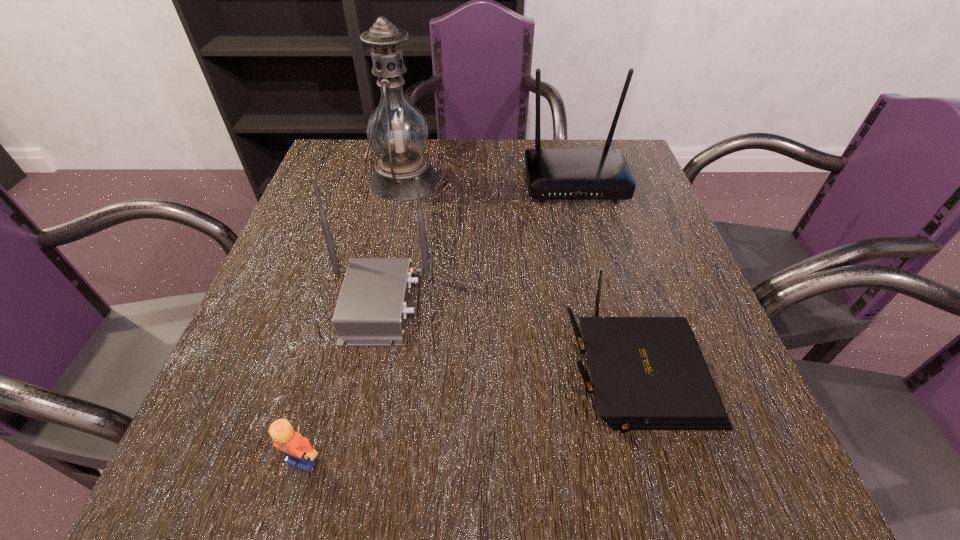
This screenshot has width=960, height=540. I want to click on oil lamp, so click(397, 132).

This screenshot has width=960, height=540. Find the location of `the farthest router`. the farthest router is located at coordinates (552, 174).

Where is `the leftmost router`? the leftmost router is located at coordinates (371, 310).

Locate an element on the screen. This screenshot has width=960, height=540. the shortest router is located at coordinates (648, 373).

At what (x,y) coordinates should I click in order to perform the action: click on Lego. Please return your answer as a coordinate pair (x, y). This screenshot has height=540, width=960. Looking at the image, I should click on (298, 449).

Image resolution: width=960 pixels, height=540 pixels. What are the coordinates of `free location located 0.300m on the right of the oil lamp` in the screenshot? It's located at (557, 180).

This screenshot has height=540, width=960. I want to click on vacant point located 0.290m on the front-facing side of the farthest router, so click(606, 296).

Find the location of a particular element. free spot located on the back of the leftmost router to connect cables is located at coordinates (623, 303).

Where is `vacant space located 0.400m on the back of the shortest router`? vacant space located 0.400m on the back of the shortest router is located at coordinates (583, 187).

Find the location of a particular element. oil lamp located in the far edge section of the desktop is located at coordinates (397, 132).